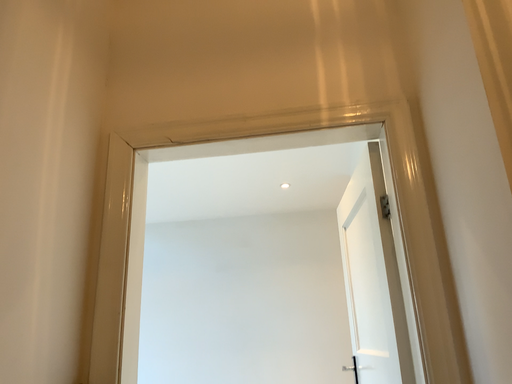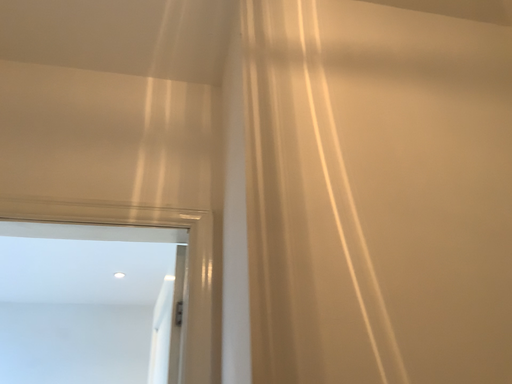
Question: Which way did the camera rotate in the video?

Choices:
 (A) rotated left
 (B) rotated right

Answer: (B)